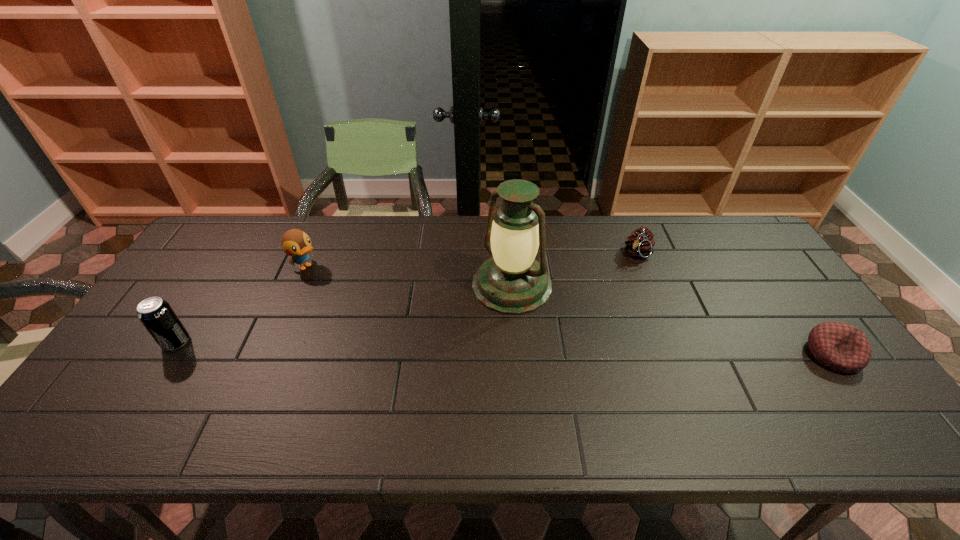
This screenshot has width=960, height=540. What are the coordinates of `free space on the desktop that is between the leftmost object and the shortest object and is positioned on the front-facing side of the duck` in the screenshot? It's located at (430, 347).

Find the location of a particular element. This screenshot has height=540, width=960. vacant space on the desktop that is between the leftmost object and the shortest object and is positioned with a leaf charm attached to the fourth object from left to right is located at coordinates (583, 350).

The height and width of the screenshot is (540, 960). Find the location of `free space on the desktop that is between the soda can and the shortest object and is positioned with the light compartment facing forward on the tallest object`. free space on the desktop that is between the soda can and the shortest object and is positioned with the light compartment facing forward on the tallest object is located at coordinates (445, 347).